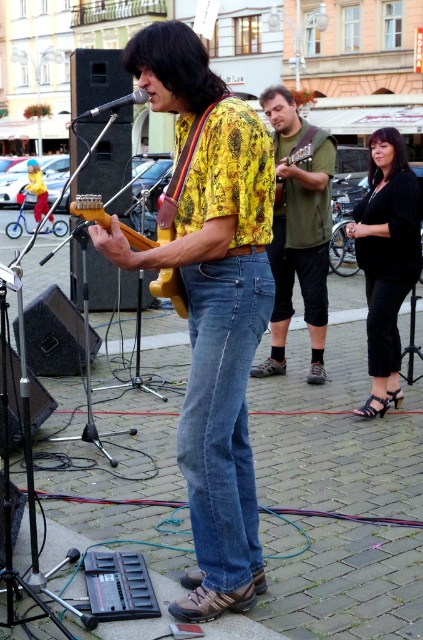
Is yellow printed shirt at center to the left of denim jeans at center from the viewer's perspective?

Indeed, yellow printed shirt at center is positioned on the left side of denim jeans at center.

Is yellow printed shirt at center taller than denim jeans at center?

Indeed, yellow printed shirt at center has a greater height compared to denim jeans at center.

Who is more forward, (249, 177) or (198, 314)?

Positioned in front is point (249, 177).

Find the location of `yellow printed shirt at center`. yellow printed shirt at center is located at coordinates (211, 301).

Who is higher up, yellow printed shirt at center or dark brown silky hair at upper right?

dark brown silky hair at upper right is higher up.

Between point (236, 532) and point (373, 163), which one is positioned behind?

Positioned behind is point (373, 163).

Where is `yellow printed shirt at center`? This screenshot has height=640, width=423. yellow printed shirt at center is located at coordinates (211, 301).

The image size is (423, 640). What do you see at coordinates (222, 413) in the screenshot?
I see `denim jeans at center` at bounding box center [222, 413].

Is denim jeans at center taller than wooden electric guitar at center?

Indeed, denim jeans at center has a greater height compared to wooden electric guitar at center.

Where is `denim jeans at center`? The width and height of the screenshot is (423, 640). denim jeans at center is located at coordinates (222, 413).